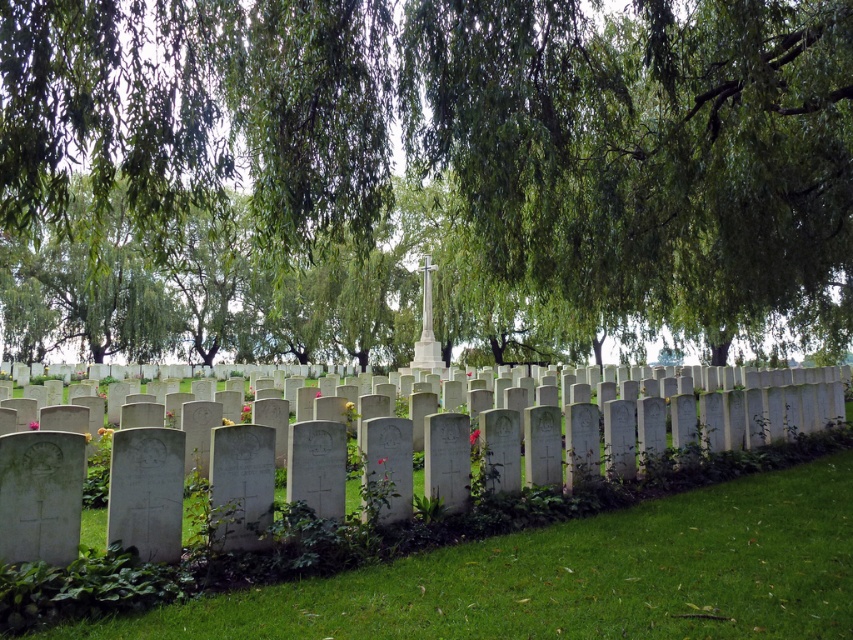
Question: Is green leafy tree at center bigger than green grass at lower center?

Choices:
 (A) no
 (B) yes

Answer: (B)

Question: Among these objects, which one is nearest to the camera?

Choices:
 (A) green leafy tree at center
 (B) green grass at lower center

Answer: (B)

Question: Can you confirm if green leafy tree at center is smaller than green grass at lower center?

Choices:
 (A) no
 (B) yes

Answer: (A)

Question: Is the position of green leafy tree at center less distant than that of green grass at lower center?

Choices:
 (A) yes
 (B) no

Answer: (B)

Question: Which object is closer to the camera taking this photo?

Choices:
 (A) green leafy tree at center
 (B) green grass at lower center

Answer: (B)